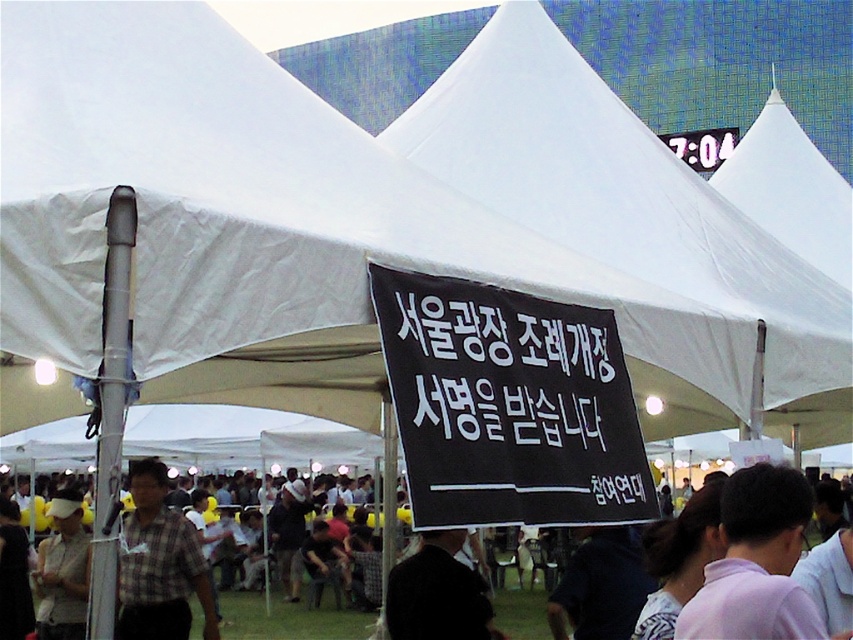
Question: Does plaid shirt at center appear on the left side of light beige fabric cap at lower left?

Choices:
 (A) no
 (B) yes

Answer: (A)

Question: Among these points, which one is farthest from the camera?

Choices:
 (A) (125, 566)
 (B) (51, 621)
 (C) (404, 596)

Answer: (B)

Question: Is pink fabric shirt at lower right wider than light beige fabric cap at lower left?

Choices:
 (A) no
 (B) yes

Answer: (A)

Question: Which point is farther to the camera?

Choices:
 (A) light beige fabric cap at lower left
 (B) plaid shirt at center
 (C) black fabric at center
 (D) pink fabric shirt at lower right

Answer: (A)

Question: Which of the following is the closest to the observer?

Choices:
 (A) light beige fabric cap at lower left
 (B) black fabric at center

Answer: (B)

Question: Is pink fabric shirt at lower right to the left of black fabric at center from the viewer's perspective?

Choices:
 (A) no
 (B) yes

Answer: (A)